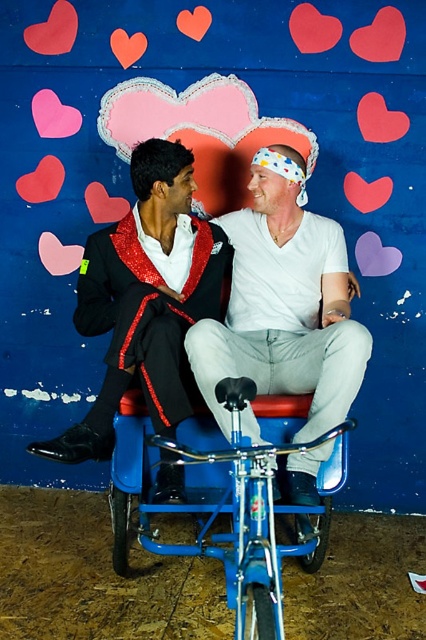
Question: Does shiny sequined suit at center have a larger size compared to blue metallic bicycle at center?

Choices:
 (A) no
 (B) yes

Answer: (B)

Question: Does shiny sequined suit at center have a lesser width compared to blue metallic bicycle at center?

Choices:
 (A) no
 (B) yes

Answer: (A)

Question: Can you confirm if shiny sequined suit at center is positioned to the left of blue metallic bicycle at center?

Choices:
 (A) yes
 (B) no

Answer: (A)

Question: Which point appears closest to the camera in this image?

Choices:
 (A) (178, 547)
 (B) (178, 317)

Answer: (A)

Question: Which point is farther to the camera?

Choices:
 (A) blue metallic bicycle at center
 (B) shiny sequined suit at center

Answer: (B)

Question: Which object is farther from the camera taking this photo?

Choices:
 (A) blue metallic bicycle at center
 (B) shiny sequined suit at center

Answer: (B)